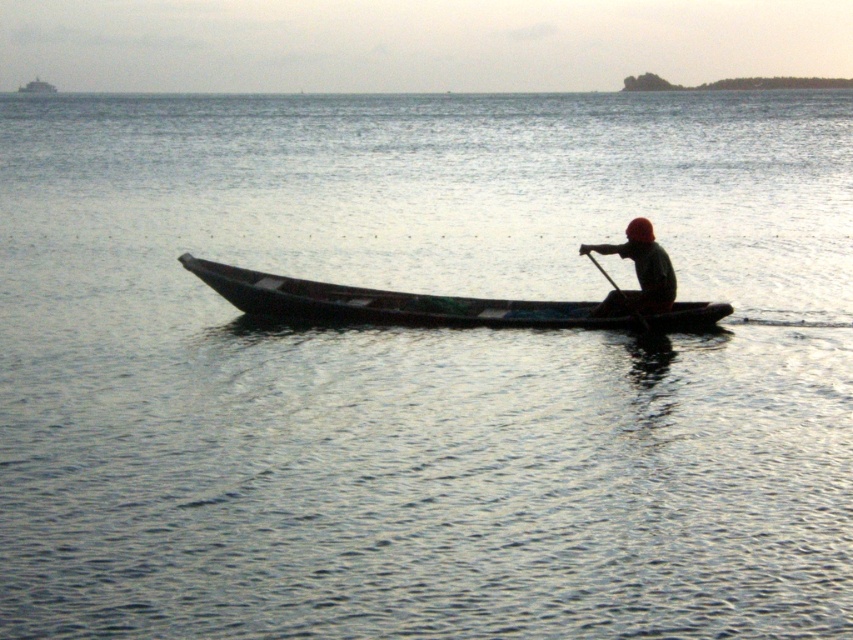
Question: Can you confirm if dark green fabric at center is positioned above wooden at center?

Choices:
 (A) no
 (B) yes

Answer: (B)

Question: From the image, what is the correct spatial relationship of dark wood canoe at center in relation to dark green fabric at center?

Choices:
 (A) left
 (B) right

Answer: (A)

Question: Estimate the real-world distances between objects in this image. Which object is closer to the dark green fabric at center?

Choices:
 (A) wooden at center
 (B) dark wood canoe at center

Answer: (A)

Question: Among these points, which one is farthest from the camera?

Choices:
 (A) (668, 332)
 (B) (589, 250)
 (C) (589, 250)

Answer: (A)

Question: Does dark green fabric at center have a lesser width compared to wooden at center?

Choices:
 (A) yes
 (B) no

Answer: (B)

Question: Based on their relative distances, which object is nearer to the dark wood canoe at center?

Choices:
 (A) dark green fabric at center
 (B) wooden at center

Answer: (A)